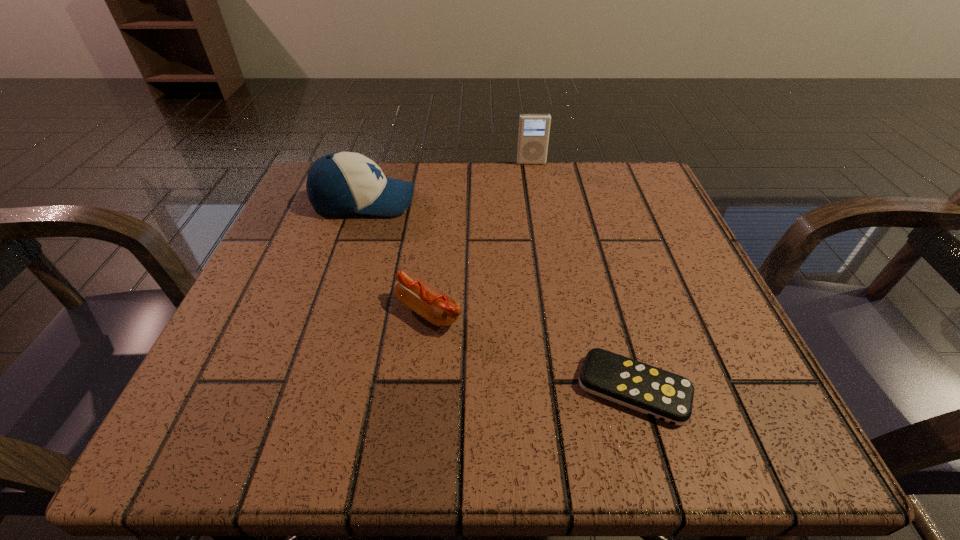
Find the location of a particular element. This screenshot has width=960, height=540. iPod positioned at the far edge is located at coordinates (533, 136).

At what (x,y) coordinates should I click in order to perform the action: click on baseball cap at the far edge. Please return your answer as a coordinate pair (x, y). This screenshot has height=540, width=960. Looking at the image, I should click on (340, 183).

At what (x,y) coordinates should I click in order to perform the action: click on object situated at the near edge. Please return your answer as a coordinate pair (x, y). The image size is (960, 540). Looking at the image, I should click on (661, 394).

Identify the location of object that is at the left edge. (340, 183).

Locate an element on the screen. This screenshot has height=540, width=960. object at the right edge is located at coordinates (661, 394).

Image resolution: width=960 pixels, height=540 pixels. Find the location of `object that is at the far left corner`. object that is at the far left corner is located at coordinates (340, 183).

The image size is (960, 540). What are the coordinates of `object that is at the near right corner` in the screenshot? It's located at (661, 394).

At what (x,y) coordinates should I click in order to perform the action: click on vacant space at the far edge. Please return your answer as a coordinate pair (x, y). The width and height of the screenshot is (960, 540). Looking at the image, I should click on 516,175.

Identify the location of free space at the near edge of the desktop. (597, 404).

The height and width of the screenshot is (540, 960). In the image, there is a desktop. In order to click on vacant space at the left edge in this screenshot , I will do `click(238, 315)`.